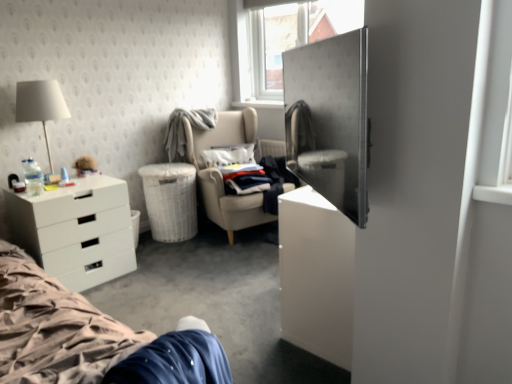
Question: Is white matte lampshade at upper left located within white matte drawer at lower left?

Choices:
 (A) no
 (B) yes

Answer: (A)

Question: Can you confirm if white matte drawer at lower left is smaller than white matte lampshade at upper left?

Choices:
 (A) no
 (B) yes

Answer: (A)

Question: Is white matte drawer at lower left located outside white matte lampshade at upper left?

Choices:
 (A) yes
 (B) no

Answer: (A)

Question: From a real-world perspective, is white matte drawer at lower left located higher than white matte lampshade at upper left?

Choices:
 (A) no
 (B) yes

Answer: (A)

Question: Is white matte drawer at lower left not near white matte lampshade at upper left?

Choices:
 (A) no
 (B) yes

Answer: (A)

Question: From the image's perspective, is white fabric pillow at center located above or below clear plastic bottle at left?

Choices:
 (A) below
 (B) above

Answer: (B)

Question: Is point (247, 145) positioned closer to the camera than point (37, 190)?

Choices:
 (A) farther
 (B) closer

Answer: (A)

Question: In the image, is white fabric pillow at center positioned in front of or behind clear plastic bottle at left?

Choices:
 (A) front
 (B) behind

Answer: (B)

Question: Is white fabric pillow at center to the left or to the right of clear plastic bottle at left in the image?

Choices:
 (A) left
 (B) right

Answer: (B)

Question: Does point (262, 221) appear closer or farther from the camera than point (332, 104)?

Choices:
 (A) farther
 (B) closer

Answer: (A)

Question: From the image's perspective, is beige fabric chair at center positioned above or below metallic silver armoire at right?

Choices:
 (A) below
 (B) above

Answer: (A)

Question: From a real-world perspective, relative to metallic silver armoire at right, is beige fabric chair at center vertically above or below?

Choices:
 (A) above
 (B) below

Answer: (B)

Question: From their relative heights in the image, would you say beige fabric chair at center is taller or shorter than metallic silver armoire at right?

Choices:
 (A) tall
 (B) short

Answer: (A)

Question: Which is correct: white fabric pillow at center is inside white matte lampshade at upper left, or outside of it?

Choices:
 (A) inside
 (B) outside

Answer: (B)

Question: In terms of size, does white fabric pillow at center appear bigger or smaller than white matte lampshade at upper left?

Choices:
 (A) small
 (B) big

Answer: (A)